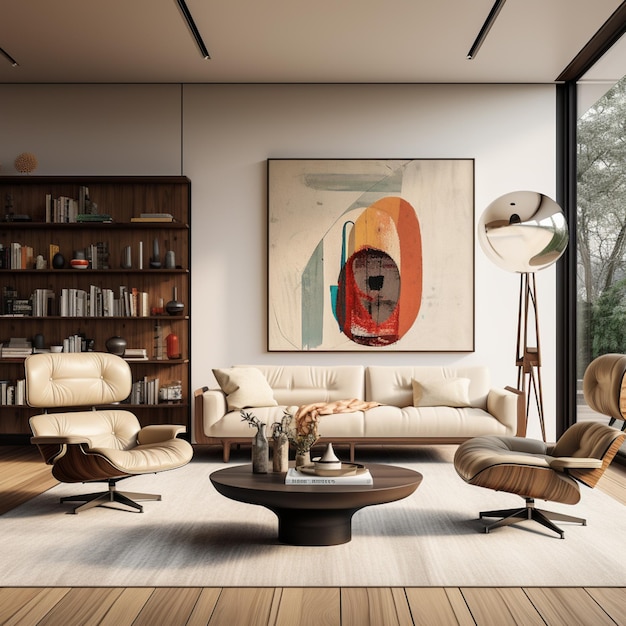
Identify the location of mirror. (508, 217).